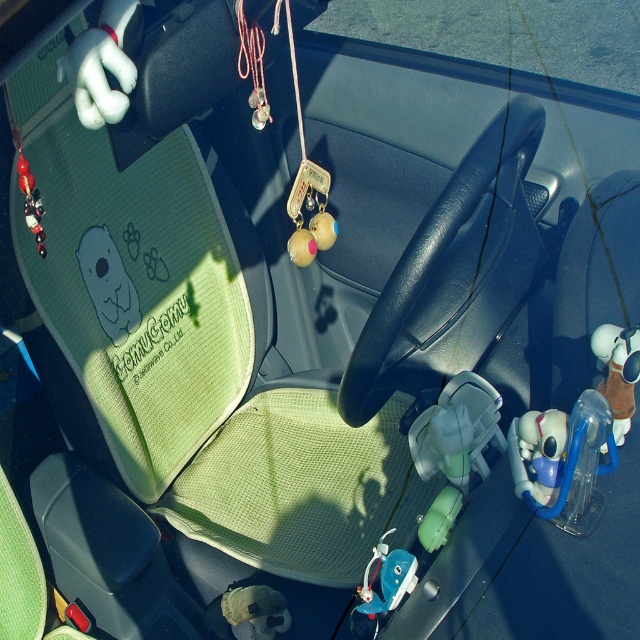
Does translucent plastic toy at center appear under white plush toy at right?

Indeed, translucent plastic toy at center is positioned under white plush toy at right.

Where is `translucent plastic toy at center`? Image resolution: width=640 pixels, height=640 pixels. translucent plastic toy at center is located at coordinates (538, 452).

Is white plush toy at right positioned at the back of blue plastic toy at center?

No, it is not.

Which is above, white plush toy at right or blue plastic toy at center?

white plush toy at right

The image size is (640, 640). I want to click on white plush toy at right, so click(618, 371).

Which of these two, translucent plastic toy at center or blue plastic toy at center, stands taller?

translucent plastic toy at center is taller.

Does translucent plastic toy at center lie behind blue plastic toy at center?

No, it is not.

Is point (509, 451) less distant than point (371, 609)?

Yes, point (509, 451) is closer to viewer.

Find the location of a particular element. The width and height of the screenshot is (640, 640). translucent plastic toy at center is located at coordinates (538, 452).